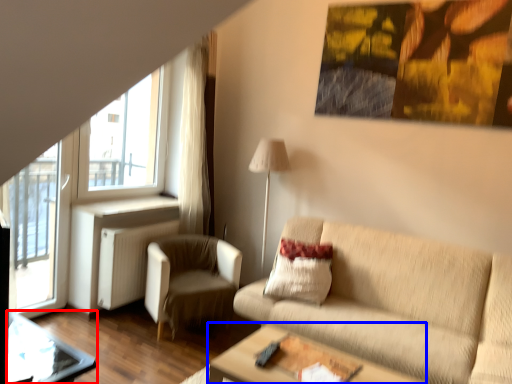
Question: Among these objects, which one is farthest to the camera, glass table (highlighted by a red box) or table (highlighted by a blue box)?

Choices:
 (A) glass table
 (B) table

Answer: (B)